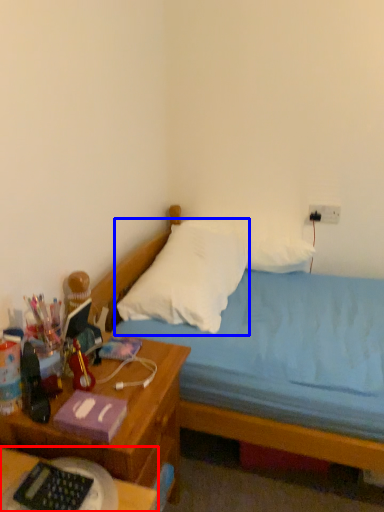
Question: Among these objects, which one is farthest to the camera, desk (highlighted by a red box) or pillow (highlighted by a blue box)?

Choices:
 (A) desk
 (B) pillow

Answer: (B)